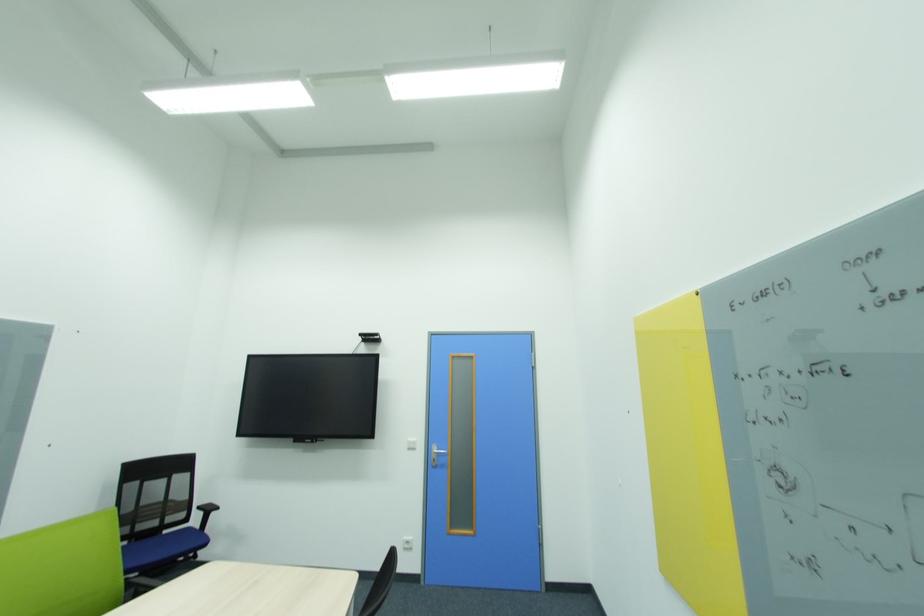
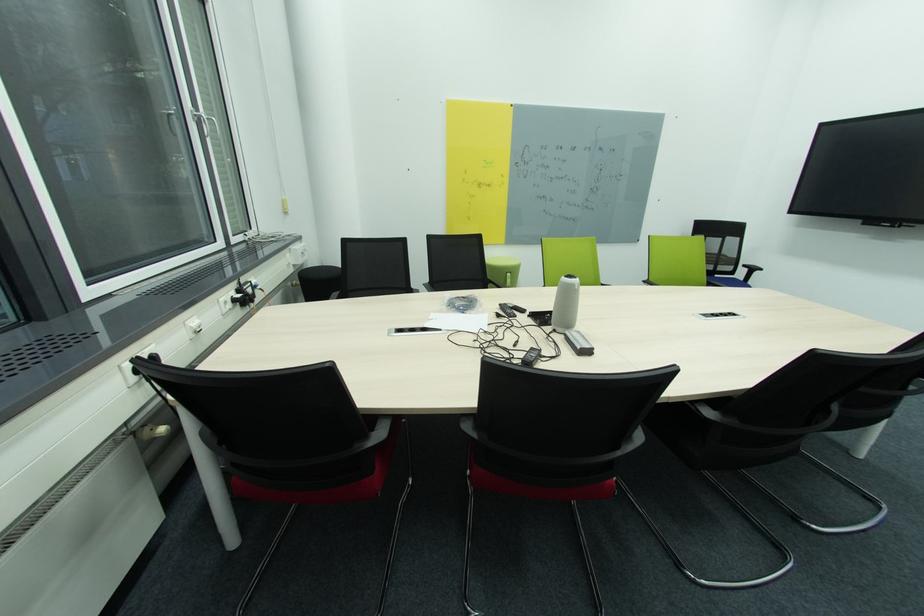
Where in the second image is the point corresponding to pixel 204 509 from the first image?

(749, 267)